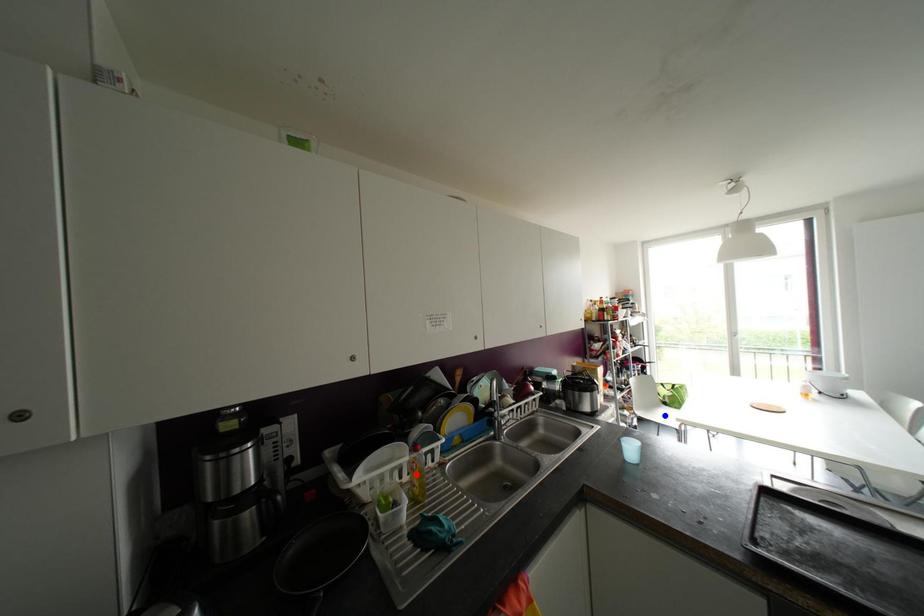
Question: Which of the two points in the image is closer to the camera?

Choices:
 (A) Blue point is closer.
 (B) Red point is closer.

Answer: (B)